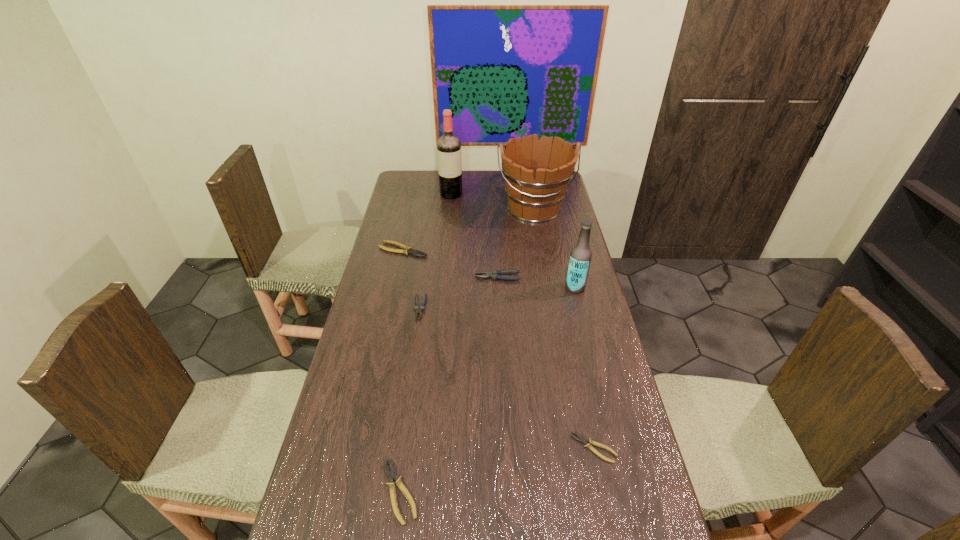
At what (x,y) coordinates should I click in order to perform the action: click on pliers at the right edge. Please return your answer as a coordinate pair (x, y). The width and height of the screenshot is (960, 540). Looking at the image, I should click on (588, 443).

Where is `object at the far right corner`? Image resolution: width=960 pixels, height=540 pixels. object at the far right corner is located at coordinates (537, 173).

What are the coordinates of `vacant area at the far edge of the desktop` in the screenshot? It's located at (497, 187).

Identify the location of free space at the left edge of the desktop. The height and width of the screenshot is (540, 960). (365, 345).

Where is `vacant area at the right edge of the desktop`? Image resolution: width=960 pixels, height=540 pixels. vacant area at the right edge of the desktop is located at coordinates (588, 408).

You are a GUI agent. You are given a task and a screenshot of the screen. Output one action in this format:
    pyautogui.click(x=<x>, y=<y>)
    Task: Click on the free location at the far left corner of the desktop
    This screenshot has height=540, width=960.
    Given the screenshot: What is the action you would take?
    pyautogui.click(x=416, y=181)

Identify the location of free spot between the eighth tallest object and the second shortest pliers. The image size is (960, 540). (496, 470).

Locate an element on the screen. This screenshot has width=960, height=540. free spot between the liquor and the second biggest yellow pliers is located at coordinates (425, 343).

This screenshot has width=960, height=540. Find the location of `empty space that is in between the beer bottle and the farthest yellow pliers`. empty space that is in between the beer bottle and the farthest yellow pliers is located at coordinates (490, 269).

Where is `empty location between the right gray pliers and the beer bottle`? The width and height of the screenshot is (960, 540). empty location between the right gray pliers and the beer bottle is located at coordinates (537, 282).